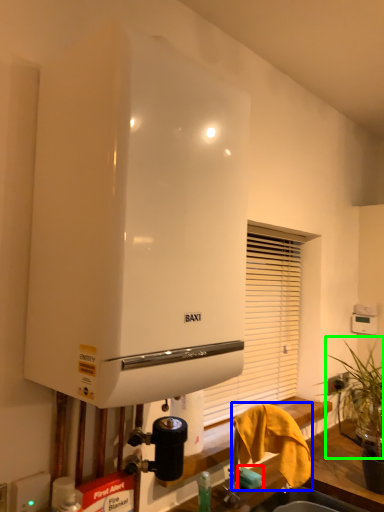
Question: Considering the real-world distances, which object is farthest from soap (highlighted by a red box)? bath towel (highlighted by a blue box) or plant (highlighted by a green box)?

Choices:
 (A) bath towel
 (B) plant

Answer: (B)